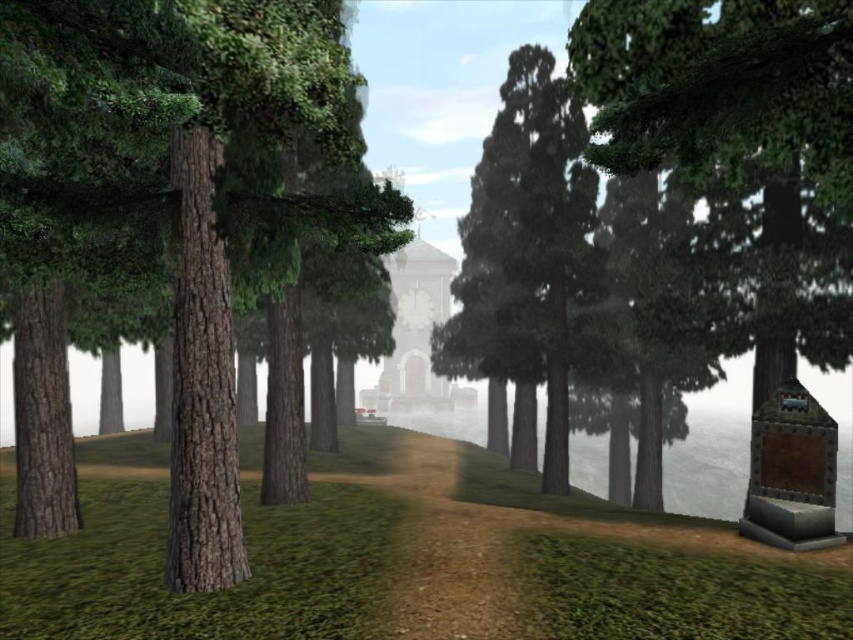
Is smooth brown tree trunk at left further to camera compared to green textured tree at right?

Yes, smooth brown tree trunk at left is behind green textured tree at right.

Is point (107, 188) positioned after point (595, 145)?

Yes, it is.

You are a GUI agent. You are given a task and a screenshot of the screen. Output one action in this format:
    pyautogui.click(x=<x>, y=<y>)
    Task: Click on the smooth brown tree trunk at left
    
    Given the screenshot: What is the action you would take?
    pyautogui.click(x=184, y=195)

Between point (270, 17) and point (579, 152), which one is positioned behind?

Positioned behind is point (579, 152).

Describe the element at coordinates (184, 195) in the screenshot. This screenshot has height=640, width=853. I see `smooth brown tree trunk at left` at that location.

Does point (90, 145) lie behind point (520, 163)?

That is False.

The width and height of the screenshot is (853, 640). Find the location of `smooth brown tree trunk at left`. smooth brown tree trunk at left is located at coordinates (184, 195).

Does green textured tree at right come in front of green matte tree at center?

That is True.

From the picture: Does green textured tree at right appear under green matte tree at center?

Indeed, green textured tree at right is positioned under green matte tree at center.

Between point (665, 22) and point (590, 188), which one is positioned behind?

The point (590, 188) is more distant.

Where is `green textured tree at right`? The height and width of the screenshot is (640, 853). green textured tree at right is located at coordinates (721, 88).